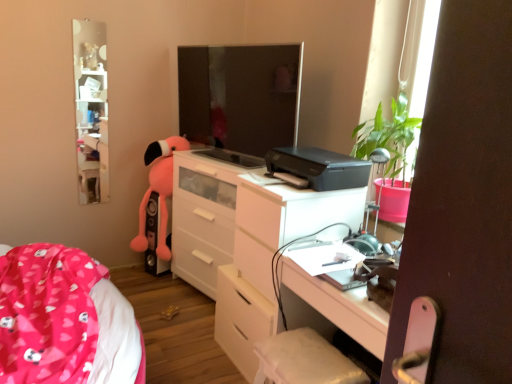
Question: From the image's perspective, relative to pink plush toy at left, is matte black monitor at center above or below?

Choices:
 (A) above
 (B) below

Answer: (A)

Question: In terms of width, does matte black monitor at center look wider or thinner when compared to pink plush toy at left?

Choices:
 (A) thin
 (B) wide

Answer: (A)

Question: Based on their relative distances, which object is farther from the matte black monitor at center?

Choices:
 (A) white glossy chest of drawers at center
 (B) pink fabric bed at lower left
 (C) black plastic printer at center
 (D) white fabric swivel chair at lower center
 (E) black matte speaker at lower left

Answer: (D)

Question: Estimate the real-world distances between objects in this image. Which object is closer to the black plastic printer at center?

Choices:
 (A) white fabric swivel chair at lower center
 (B) pink fabric bed at lower left
 (C) matte black monitor at center
 (D) white glossy chest of drawers at center
 (E) white glossy cabinet at upper left

Answer: (D)